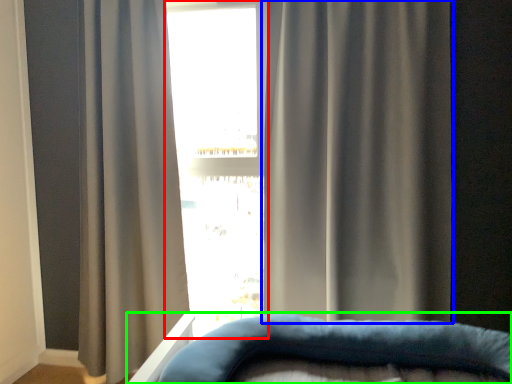
Question: Which object is the farthest from bay window (highlighted by a red box)? Choose among these: curtain (highlighted by a blue box) or furniture (highlighted by a green box).

Choices:
 (A) curtain
 (B) furniture

Answer: (B)